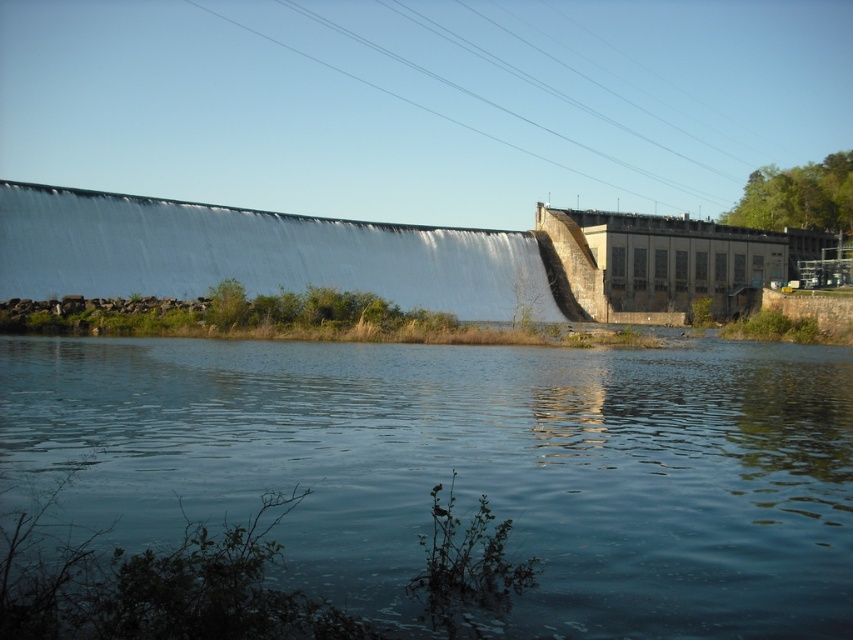
You are standing on the observation deck near the dam and notice the blue water at center and the white smooth dam at upper center. Which one appears larger in size when viewed from your current position?

The white smooth dam at upper center appears larger in size than the blue water at center because the blue water at center is smaller than the white smooth dam at upper center.

You are a photographer standing at the edge of the reservoir. You want to capture a photo that includes both the blue water at center and the white smooth dam at upper center. Based on their positions, which object will appear larger in the photo?

The blue water at center appears larger in the photo because it is closer to the photographer than the white smooth dam at upper center, which is further away.